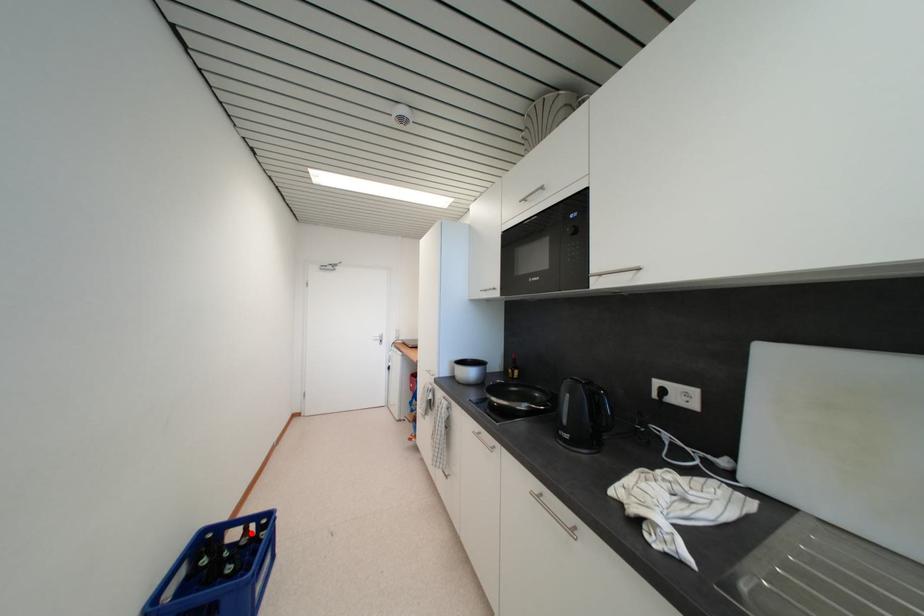
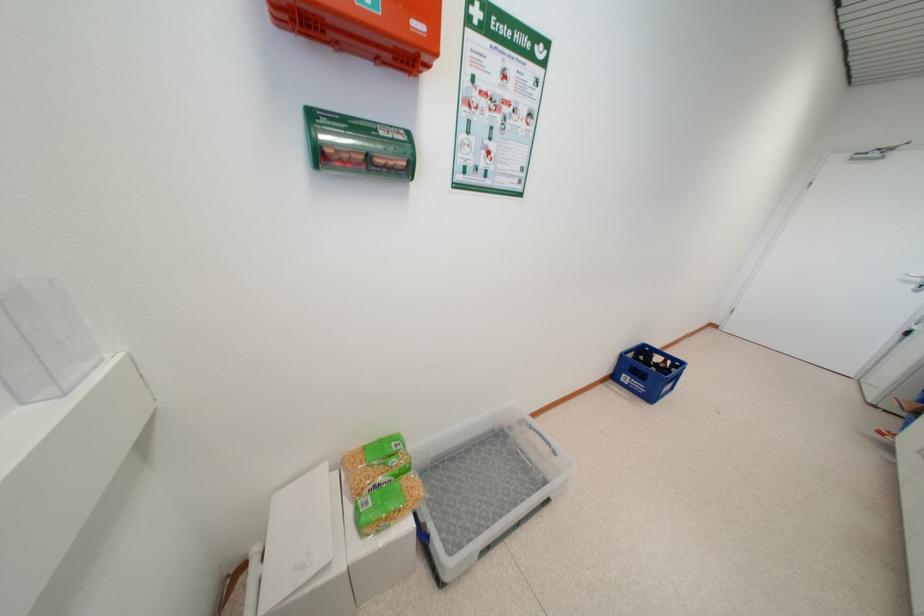
The point at the highlighted location is marked in the first image. Where is the corresponding point in the second image?

(669, 363)